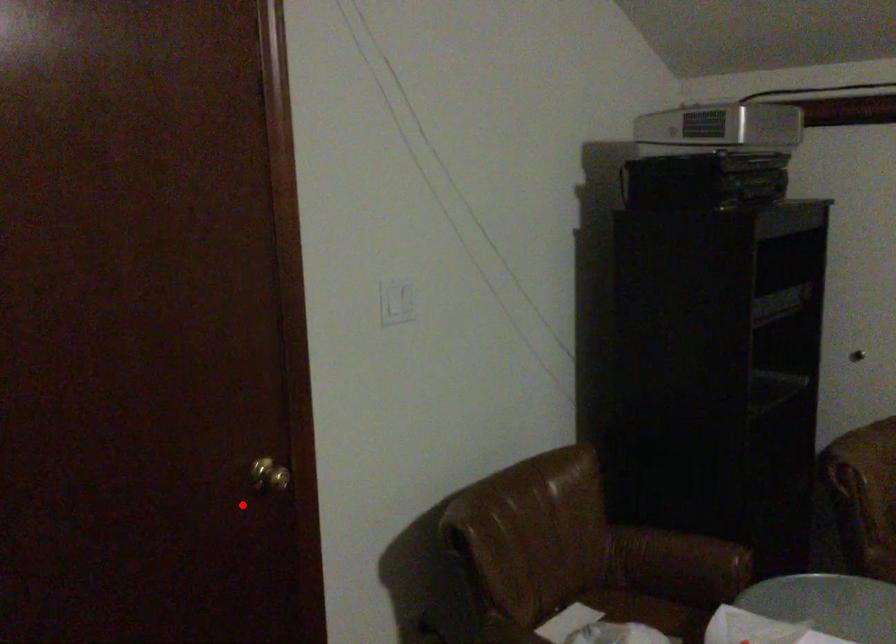
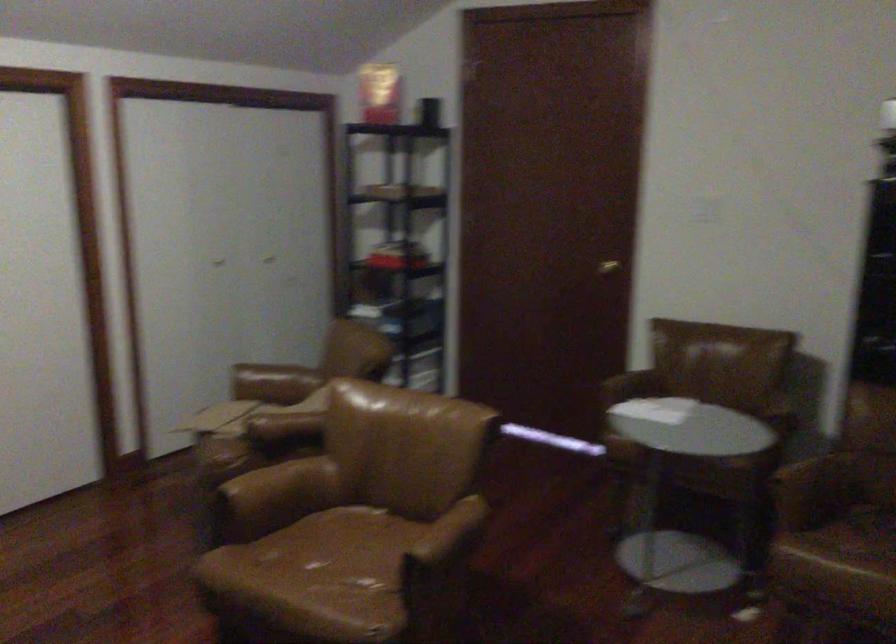
The point at the highlighted location is marked in the first image. Where is the corresponding point in the second image?

(607, 267)